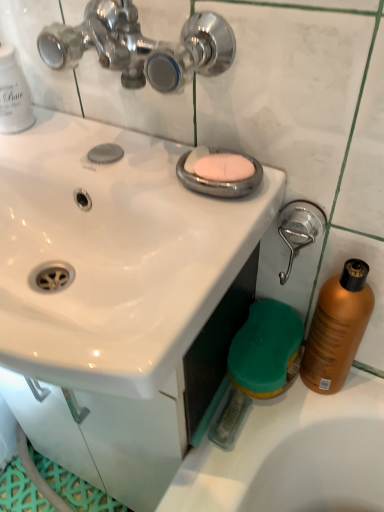
The width and height of the screenshot is (384, 512). What are the coordinates of `white glossy sink at upper center` in the screenshot? It's located at (113, 255).

Where is `shiny orange bottle at right`? The width and height of the screenshot is (384, 512). shiny orange bottle at right is located at coordinates (337, 328).

Find the location of a particular element. white glossy sink at upper center is located at coordinates (113, 255).

Does pink matte soap at center contain shiny orange bottle at right?

No, shiny orange bottle at right is not a part of pink matte soap at center.

This screenshot has height=512, width=384. I want to click on soap in front of the shiny orange bottle at right, so click(x=224, y=167).

Considering the positions of objects pink matte soap at center and shiny orange bottle at right in the image provided, who is more to the right, pink matte soap at center or shiny orange bottle at right?

Positioned to the right is shiny orange bottle at right.

Is pink matte soap at center next to brushed metal shower head at right and touching it?

pink matte soap at center is not next to brushed metal shower head at right, and they're not touching.

Based on the photo, is pink matte soap at center shorter than brushed metal shower head at right?

Yes, pink matte soap at center is shorter than brushed metal shower head at right.

Between pink matte soap at center and brushed metal shower head at right, which one appears on the right side from the viewer's perspective?

brushed metal shower head at right is more to the right.

Does pink matte soap at center lie in front of brushed metal shower head at right?

Yes, it is.

Image resolution: width=384 pixels, height=512 pixels. Identify the location of shower on the left of shiny orange bottle at right. (299, 228).

From the image's perspective, would you say shiny orange bottle at right is shown under brushed metal shower head at right?

Yes.

Is shiny orange bottle at right to the left of brushed metal shower head at right from the viewer's perspective?

No.

Which object is positioned more to the left, shiny orange bottle at right or pink matte soap at center?

pink matte soap at center.

From a real-world perspective, who is located higher, shiny orange bottle at right or pink matte soap at center?

From a 3D spatial view, pink matte soap at center is above.

Considering the positions of objects shiny orange bottle at right and pink matte soap at center in the image provided, who is behind, shiny orange bottle at right or pink matte soap at center?

shiny orange bottle at right is more distant.

Consider the image. Would you say shiny orange bottle at right is a long distance from pink matte soap at center?

They are positioned close to each other.

Is white glossy sink at upper center facing away from shiny orange bottle at right?

white glossy sink at upper center is not turned away from shiny orange bottle at right.

Considering the positions of points (136, 340) and (327, 388), is point (136, 340) closer to camera compared to point (327, 388)?

Yes, point (136, 340) is in front of point (327, 388).

Considering the relative sizes of white glossy sink at upper center and shiny orange bottle at right in the image provided, is white glossy sink at upper center bigger than shiny orange bottle at right?

Correct, white glossy sink at upper center is larger in size than shiny orange bottle at right.

Locate an element on the screen. This screenshot has width=384, height=512. shower located above the shiny orange bottle at right (from a real-world perspective) is located at coordinates (299, 228).

Is brushed metal shower head at right aimed at shiny orange bottle at right?

No, brushed metal shower head at right is not turned towards shiny orange bottle at right.

Is brushed metal shower head at right far from shiny orange bottle at right?

They are positioned close to each other.

Does point (219, 155) come behind point (61, 297)?

No, (219, 155) is in front of (61, 297).

Is pink matte soap at center to the left of white glossy sink at upper center from the viewer's perspective?

In fact, pink matte soap at center is to the right of white glossy sink at upper center.

From a real-world perspective, who is located lower, pink matte soap at center or white glossy sink at upper center?

white glossy sink at upper center is physically lower.

Does pink matte soap at center have a larger size compared to white glossy sink at upper center?

No, pink matte soap at center is not bigger than white glossy sink at upper center.

The height and width of the screenshot is (512, 384). I want to click on soap above the shiny orange bottle at right (from the image's perspective), so click(224, 167).

You are a GUI agent. You are given a task and a screenshot of the screen. Output one action in this format:
    pyautogui.click(x=<x>, y=<y>)
    Task: Click on the soap that is on the left side of brushed metal shower head at right
    The height and width of the screenshot is (512, 384).
    Given the screenshot: What is the action you would take?
    224,167

When comparing their distances from brushed metal shower head at right, does white glossy sink at upper center or shiny orange bottle at right seem closer?

Based on the image, shiny orange bottle at right appears to be nearer to brushed metal shower head at right.

When comparing their distances from pink matte soap at center, does shiny orange bottle at right or brushed metal shower head at right seem further?

Among the two, shiny orange bottle at right is located further to pink matte soap at center.

Looking at the image, which one is located further to white glossy sink at upper center, brushed metal shower head at right or pink matte soap at center?

brushed metal shower head at right.

Looking at the image, which one is located closer to brushed metal shower head at right, shiny orange bottle at right or white glossy sink at upper center?

shiny orange bottle at right is positioned closer to the anchor brushed metal shower head at right.

Looking at the image, which one is located further to pink matte soap at center, white glossy sink at upper center or shiny orange bottle at right?

shiny orange bottle at right lies further to pink matte soap at center than the other object.

Estimate the real-world distances between objects in this image. Which object is closer to shiny orange bottle at right, white glossy sink at upper center or pink matte soap at center?

pink matte soap at center is closer to shiny orange bottle at right.

Considering their positions, is brushed metal shower head at right positioned closer to white glossy sink at upper center than shiny orange bottle at right?

Among the two, brushed metal shower head at right is located nearer to white glossy sink at upper center.

Estimate the real-world distances between objects in this image. Which object is further from shiny orange bottle at right, pink matte soap at center or brushed metal shower head at right?

pink matte soap at center.

Identify the location of shower between pink matte soap at center and shiny orange bottle at right in the up-down direction. (299, 228).

Identify the location of shower between white glossy sink at upper center and shiny orange bottle at right. Image resolution: width=384 pixels, height=512 pixels. (299, 228).

Locate an element on the screen. Image resolution: width=384 pixels, height=512 pixels. soap between white glossy sink at upper center and brushed metal shower head at right in the horizontal direction is located at coordinates (224, 167).

Locate an element on the screen. soap situated between white glossy sink at upper center and shiny orange bottle at right from left to right is located at coordinates (224, 167).